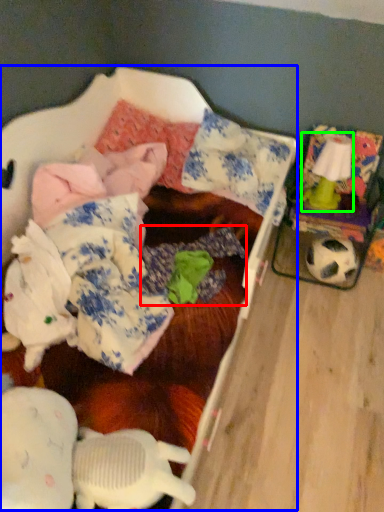
Question: Which object is the closest to the clothing (highlighted by a red box)? Choose among these: bed (highlighted by a blue box) or toy (highlighted by a green box).

Choices:
 (A) bed
 (B) toy

Answer: (A)